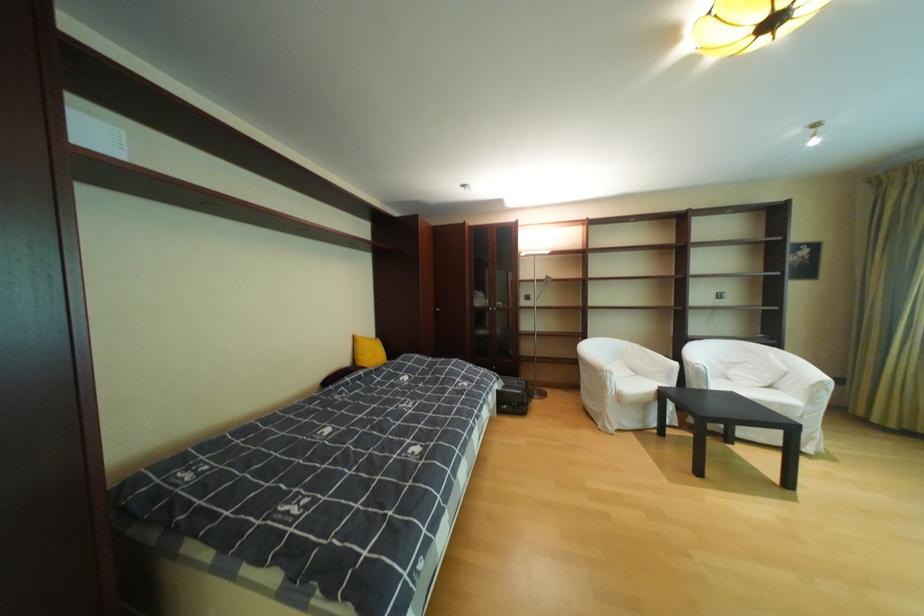
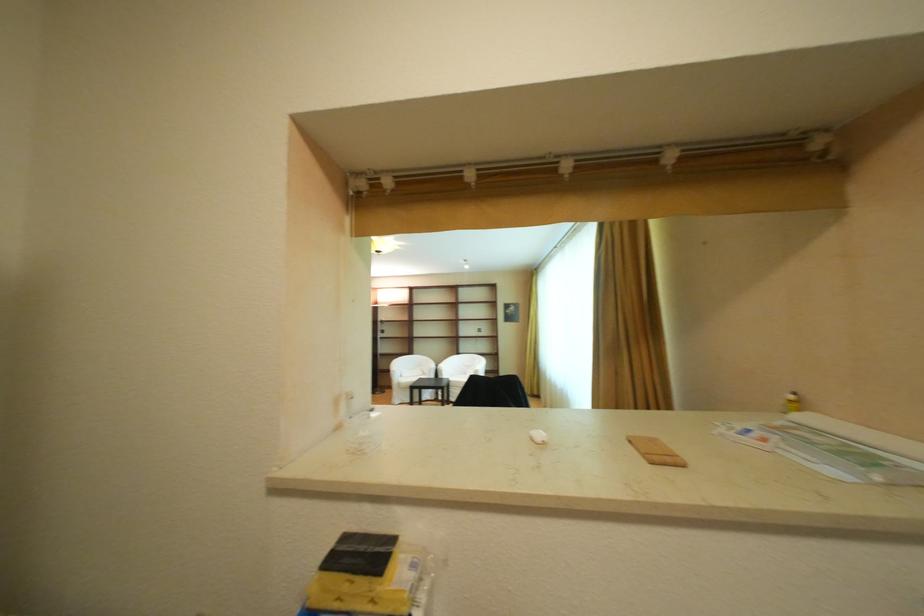
Question: I am providing you with two images of the same scene from different viewpoints. Please identify which objects are invisible in image2.

Choices:
 (A) white chair sitting surface
 (B) small yellow bottle
 (C) white remote-like object
 (D) small camera box

Answer: (A)